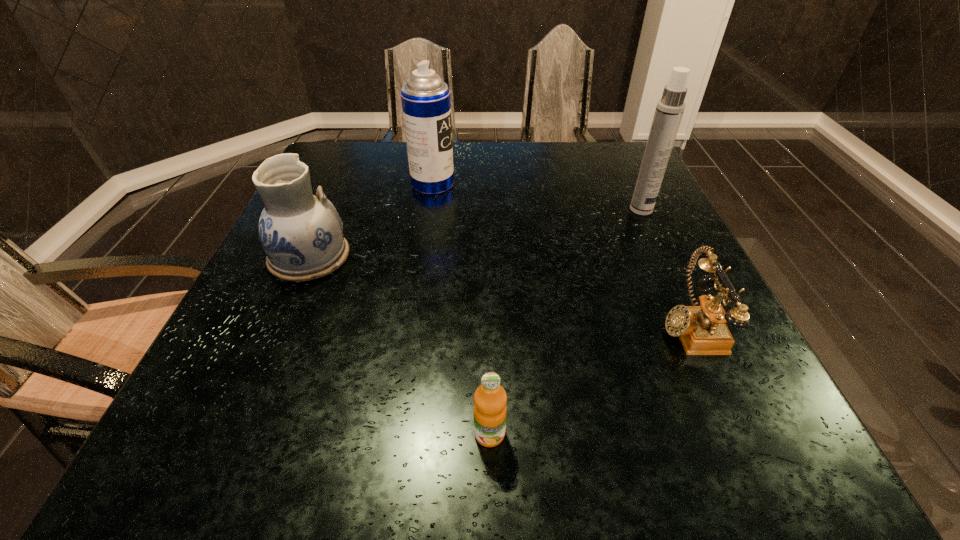
Image resolution: width=960 pixels, height=540 pixels. Identify the location of blank space at the far edge of the desktop. (473, 166).

Image resolution: width=960 pixels, height=540 pixels. In order to click on free space at the near edge of the desktop in this screenshot , I will do click(x=280, y=448).

In the image, there is a desktop. In order to click on vacant region at the left edge in this screenshot , I will do `click(349, 186)`.

The width and height of the screenshot is (960, 540). In the image, there is a desktop. Find the location of `vacant space at the right edge`. vacant space at the right edge is located at coordinates (704, 373).

Identify the location of free space at the far left corner of the desktop. The height and width of the screenshot is (540, 960). (357, 171).

Where is `free region at the far right corner of the desktop`? The width and height of the screenshot is (960, 540). free region at the far right corner of the desktop is located at coordinates (604, 148).

This screenshot has width=960, height=540. What are the coordinates of `vacant space that is in between the farthest object and the nearer aerosol can` in the screenshot? It's located at (537, 197).

Find the location of `empty location between the farthest object and the second farthest object`. empty location between the farthest object and the second farthest object is located at coordinates (537, 197).

Locate an element on the screen. The height and width of the screenshot is (540, 960). blank region between the right aerosol can and the pottery is located at coordinates (475, 233).

The height and width of the screenshot is (540, 960). Identify the location of free space between the farther aerosol can and the fourth farthest object. (561, 254).